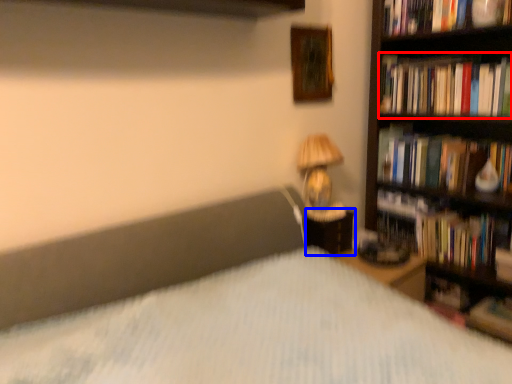
Question: Which point is closer to the camera, book (highlighted by a red box) or nightstand (highlighted by a blue box)?

Choices:
 (A) book
 (B) nightstand

Answer: (A)